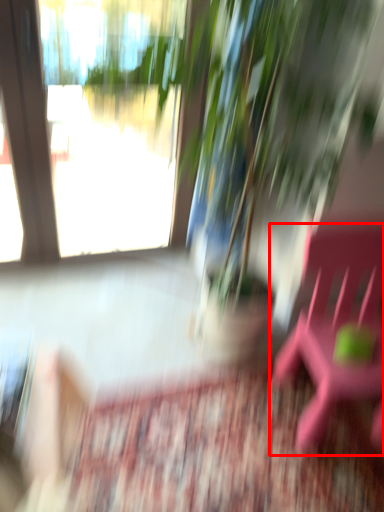
Question: Where is beach chair (annotated by the red box) located in relation to houseplant in the image?

Choices:
 (A) left
 (B) right

Answer: (B)